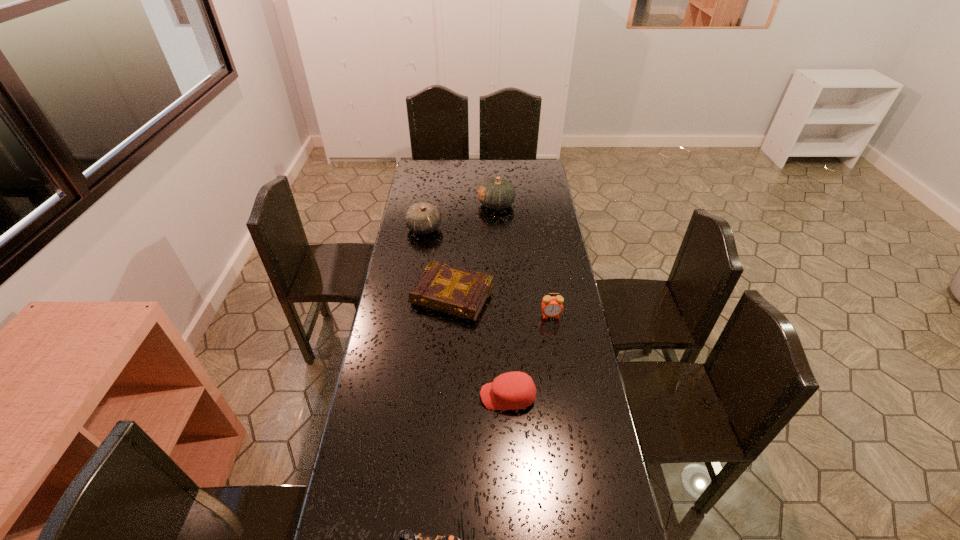
The height and width of the screenshot is (540, 960). What are the coordinates of `free region at the right edge of the desktop` in the screenshot? It's located at (615, 495).

You are a GUI agent. You are given a task and a screenshot of the screen. Output one action in this format:
    pyautogui.click(x=<x>, y=<y>)
    Task: Click on the vacant space that is in between the third shortest object and the alarm clock
    Image resolution: width=960 pixels, height=540 pixels.
    Given the screenshot: What is the action you would take?
    pyautogui.click(x=529, y=356)

I want to click on free space between the alarm clock and the fourth tallest object, so click(529, 356).

At what (x,y) coordinates should I click in order to perform the action: click on free space between the fifth nearest object and the right gourd. Please return your answer as a coordinate pair (x, y). Looking at the image, I should click on (460, 217).

Find the location of a particular element. Image resolution: width=960 pixels, height=540 pixels. empty space that is in between the alarm clock and the hardback book is located at coordinates (501, 306).

Image resolution: width=960 pixels, height=540 pixels. What are the coordinates of `vacant space in between the farthest object and the alarm clock` in the screenshot? It's located at (523, 260).

Where is `vacant space that's between the fourth tallest object and the farthest object`? vacant space that's between the fourth tallest object and the farthest object is located at coordinates (502, 300).

Locate which object is the third closest to the farthest object. Please provide its 2D coordinates. Your answer should be formatted as a tuple, i.e. [(x, y)], where the tuple contains the x and y coordinates of a point satisfying the conditions above.

[(551, 306)]

The width and height of the screenshot is (960, 540). I want to click on object that is the closest to the hardback book, so click(551, 306).